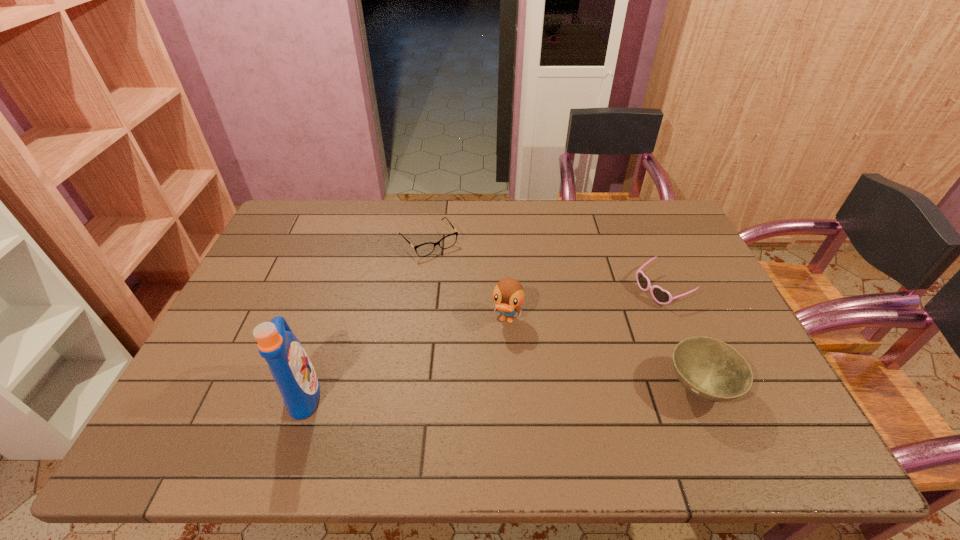
I want to click on unoccupied position between the detergent and the spectacles, so click(x=367, y=317).

This screenshot has width=960, height=540. I want to click on free space that is in between the second object from left to right and the sunglasses, so click(545, 265).

Locate which object is the second closest to the third tallest object. Please provide its 2D coordinates. Your answer should be formatted as a tuple, i.e. [(x, y)], where the tuple contains the x and y coordinates of a point satisfying the conditions above.

[(508, 294)]

Locate an element on the screen. object that ranks as the fourth closest to the detergent is located at coordinates (661, 296).

Where is `free space in the image that satisfies the following two spatial constraints: 1. on the front side of the fourth shortest object; 2. on the right side of the shortest object`? This screenshot has width=960, height=540. free space in the image that satisfies the following two spatial constraints: 1. on the front side of the fourth shortest object; 2. on the right side of the shortest object is located at coordinates (418, 320).